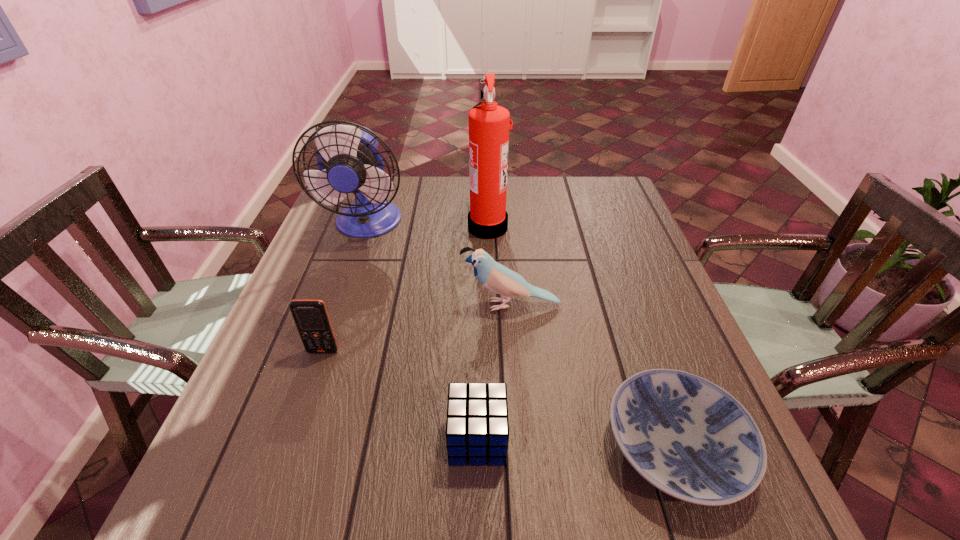
You are a GUI agent. You are given a task and a screenshot of the screen. Output one action in this format:
    pyautogui.click(x=<x>, y=<y>)
    Task: Click on the vacant position located 0.370m with the nozzle aimed from the fire extinguisher
    The image size is (960, 540).
    Given the screenshot: What is the action you would take?
    pyautogui.click(x=341, y=226)

Locate an element on the screen. vacant region located 0.200m in front of the fan where the airflow is directed is located at coordinates (341, 301).

At what (x,y) coordinates should I click in order to perform the action: click on blank space located at the face of the bird. Please return your answer as a coordinate pair (x, y). This screenshot has width=960, height=540. Looking at the image, I should click on (297, 305).

Where is `vacant space located 0.210m at the face of the bird`? This screenshot has height=540, width=960. vacant space located 0.210m at the face of the bird is located at coordinates (372, 305).

Where is `vacant area situated 0.050m at the face of the bird`? vacant area situated 0.050m at the face of the bird is located at coordinates (441, 305).

The image size is (960, 540). I want to click on vacant area situated 0.120m on the screen of the cellular telephone, so click(305, 404).

Locate an element on the screen. vacant space located 0.200m on the right of the cube is located at coordinates (618, 439).

This screenshot has width=960, height=540. I want to click on free region located on the left of the rightmost object, so click(463, 447).

Where is `fire extinguisher present at the far edge`? fire extinguisher present at the far edge is located at coordinates (489, 127).

Locate an element on the screen. Image resolution: width=960 pixels, height=540 pixels. fan situated at the far edge is located at coordinates 349,161.